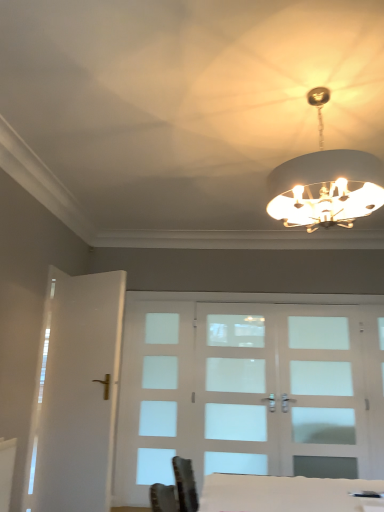
Where is `free spot above clear glass door at center, which is the second screen door from left to right (from a real-world perspective)`? Image resolution: width=384 pixels, height=512 pixels. free spot above clear glass door at center, which is the second screen door from left to right (from a real-world perspective) is located at coordinates (246, 298).